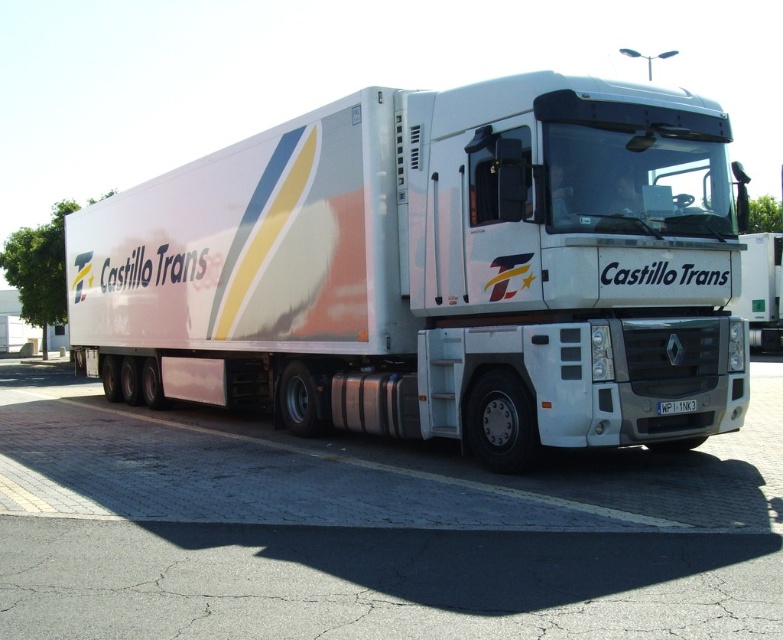
Does white glossy trailer truck at center appear under white glossy truck at center?

Yes.

Which is above, white glossy trailer truck at center or white glossy truck at center?

white glossy truck at center is higher up.

The height and width of the screenshot is (640, 783). Find the location of `white glossy trailer truck at center`. white glossy trailer truck at center is located at coordinates (435, 269).

What do you see at coordinates (435, 269) in the screenshot? I see `white glossy trailer truck at center` at bounding box center [435, 269].

Can you confirm if white glossy trailer truck at center is wider than white plastic license plate at center?

Correct, the width of white glossy trailer truck at center exceeds that of white plastic license plate at center.

What are the coordinates of `white glossy trailer truck at center` in the screenshot? It's located at 435,269.

Identify the location of white glossy trailer truck at center. (435, 269).

Between white glossy truck at center and white plastic license plate at center, which one has more height?

white glossy truck at center is taller.

Is white glossy truck at center smaller than white plastic license plate at center?

Actually, white glossy truck at center might be larger than white plastic license plate at center.

The width and height of the screenshot is (783, 640). What do you see at coordinates (760, 289) in the screenshot?
I see `white glossy truck at center` at bounding box center [760, 289].

You are a GUI agent. You are given a task and a screenshot of the screen. Output one action in this format:
    pyautogui.click(x=<x>, y=<y>)
    Task: Click on the white glossy truck at center
    The height and width of the screenshot is (640, 783).
    Given the screenshot: What is the action you would take?
    pyautogui.click(x=760, y=289)